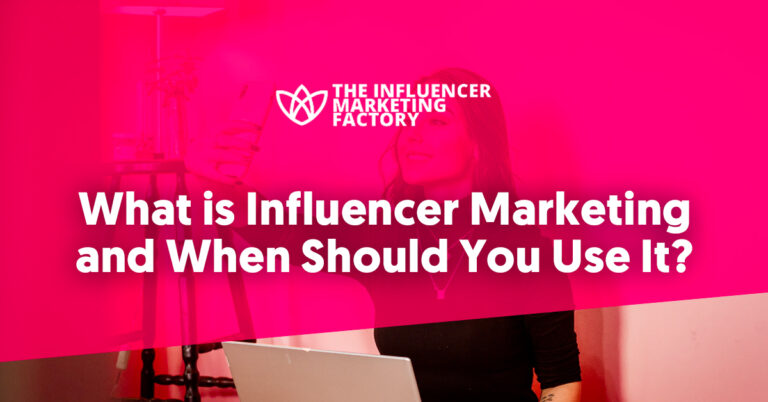
At what (x,y) coordinates should I click in order to perform the action: click on wall. Please return your answer as a coordinate pair (x, y). This screenshot has width=768, height=402. Looking at the image, I should click on (690, 348), (335, 344).